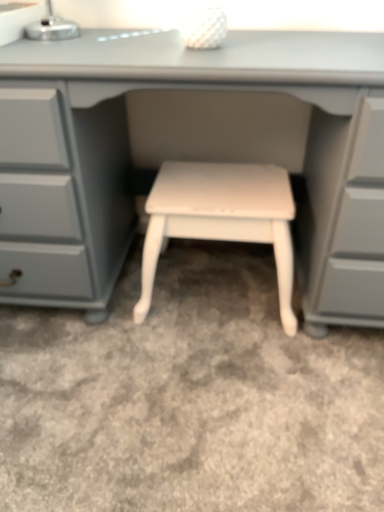
Describe the element at coordinates (221, 218) in the screenshot. The height and width of the screenshot is (512, 384). I see `white painted wood stool at center` at that location.

Where is `white painted wood stool at center`? white painted wood stool at center is located at coordinates (221, 218).

This screenshot has height=512, width=384. Find the location of `matte gray desk at center`. matte gray desk at center is located at coordinates (218, 152).

What do you see at coordinates (218, 152) in the screenshot?
I see `matte gray desk at center` at bounding box center [218, 152].

Find the location of a particular element. white painted wood stool at center is located at coordinates (221, 218).

Does matte gray desk at center appear on the left side of white painted wood stool at center?

Yes.

Which object is more forward, matte gray desk at center or white painted wood stool at center?

matte gray desk at center is in front.

Is point (314, 138) less distant than point (159, 226)?

No, it is not.

From the image's perspective, is matte gray desk at center located above or below white painted wood stool at center?

matte gray desk at center is above white painted wood stool at center.

From a real-world perspective, is matte gray desk at center on white painted wood stool at center?

Yes, from a real-world perspective, matte gray desk at center is over white painted wood stool at center

Can you confirm if matte gray desk at center is thinner than white painted wood stool at center?

Result: No.

Who is taller, matte gray desk at center or white painted wood stool at center?

With more height is matte gray desk at center.

Does matte gray desk at center have a smaller size compared to white painted wood stool at center?

Incorrect, matte gray desk at center is not smaller in size than white painted wood stool at center.

Can we say matte gray desk at center lies outside white painted wood stool at center?

matte gray desk at center is positioned outside white painted wood stool at center.

Is matte gray desk at center placed right next to white painted wood stool at center?

No, matte gray desk at center is not with white painted wood stool at center.

Is matte gray desk at center oriented away from white painted wood stool at center?

Yes, matte gray desk at center's orientation is away from white painted wood stool at center.

Can you tell me how much matte gray desk at center and white painted wood stool at center differ in facing direction?

The angle between the facing direction of matte gray desk at center and the facing direction of white painted wood stool at center is 0.000407 degrees.

In the image, there is a matte gray desk at center. Where is `stool below it (from a real-world perspective)`? The image size is (384, 512). stool below it (from a real-world perspective) is located at coordinates (221, 218).

Does white painted wood stool at center appear on the right side of matte gray desk at center?

Yes, white painted wood stool at center is to the right of matte gray desk at center.

Is the depth of white painted wood stool at center greater than that of matte gray desk at center?

Yes, white painted wood stool at center is behind matte gray desk at center.

Is point (192, 201) closer or farther from the camera than point (121, 178)?

Point (192, 201) appears to be closer to the viewer than point (121, 178).

From the image's perspective, which one is positioned lower, white painted wood stool at center or matte gray desk at center?

From the image's view, white painted wood stool at center is below.

Consider the image. From a real-world perspective, which is physically above, white painted wood stool at center or matte gray desk at center?

matte gray desk at center, from a real-world perspective.

Is white painted wood stool at center wider or thinner than matte gray desk at center?

white painted wood stool at center is thinner than matte gray desk at center.

In terms of height, does white painted wood stool at center look taller or shorter compared to matte gray desk at center?

white painted wood stool at center is shorter than matte gray desk at center.

Considering the relative sizes of white painted wood stool at center and matte gray desk at center in the image provided, is white painted wood stool at center smaller than matte gray desk at center?

Yes, white painted wood stool at center is smaller than matte gray desk at center.

Is white painted wood stool at center surrounding matte gray desk at center?

No.

Is white painted wood stool at center beside matte gray desk at center?

No, white painted wood stool at center is not next to matte gray desk at center.

Is white painted wood stool at center oriented towards matte gray desk at center?

Yes, white painted wood stool at center is aimed at matte gray desk at center.

Measure the distance from white painted wood stool at center to matte gray desk at center.

The distance of white painted wood stool at center from matte gray desk at center is 4.94 inches.

This screenshot has height=512, width=384. Find the location of `desk lying on the left of white painted wood stool at center`. desk lying on the left of white painted wood stool at center is located at coordinates (218, 152).

Where is `stool located on the right of matte gray desk at center`? This screenshot has width=384, height=512. stool located on the right of matte gray desk at center is located at coordinates (221, 218).

Where is `stool below the matte gray desk at center (from the image's perspective)`? The width and height of the screenshot is (384, 512). stool below the matte gray desk at center (from the image's perspective) is located at coordinates (221, 218).